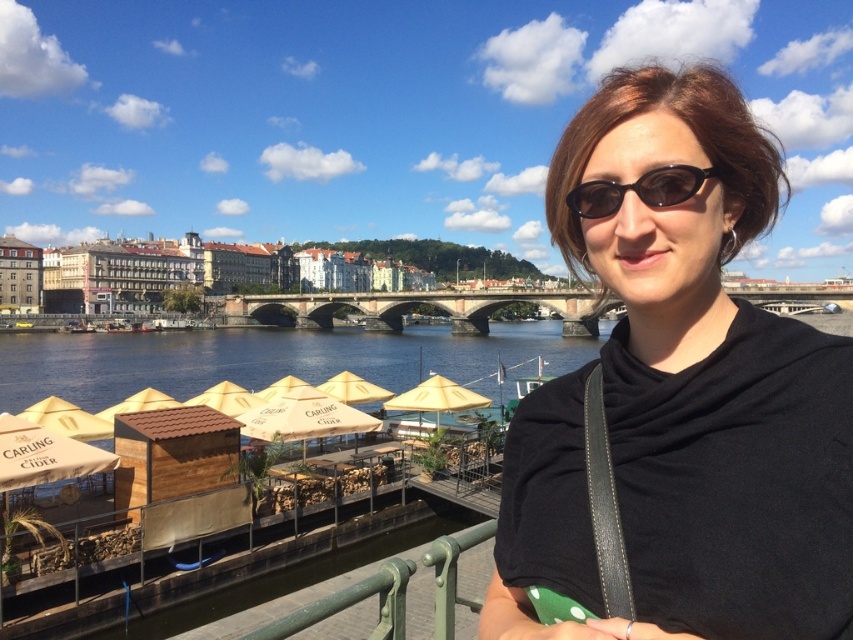
Question: Which object is the closest to the stone bridge at center?

Choices:
 (A) black matte shirt at upper right
 (B) green matte railing at lower center
 (C) black plastic sunglasses at upper center

Answer: (A)

Question: Does black matte shirt at upper right have a greater width compared to black plastic sunglasses at upper center?

Choices:
 (A) no
 (B) yes

Answer: (B)

Question: Observing the image, what is the correct spatial positioning of black matte shirt at upper right in reference to black plastic sunglasses at upper center?

Choices:
 (A) below
 (B) above

Answer: (A)

Question: Among these points, which one is farthest from the camera?

Choices:
 (A) (614, 205)
 (B) (566, 296)
 (C) (811, 515)

Answer: (B)

Question: Observing the image, what is the correct spatial positioning of black matte shirt at upper right in reference to green matte railing at lower center?

Choices:
 (A) below
 (B) above

Answer: (B)

Question: Among these points, which one is farthest from the camera?

Choices:
 (A) (656, 189)
 (B) (345, 608)
 (C) (257, 323)
 (D) (663, 576)

Answer: (C)